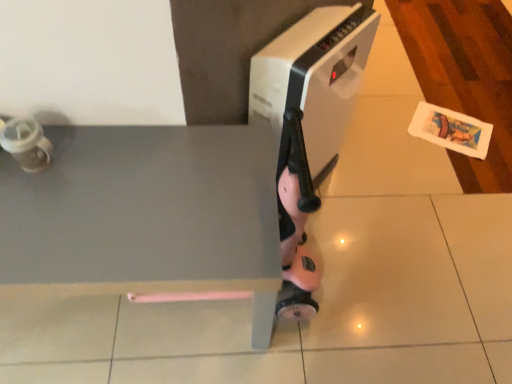
Where is `free point to the right of matte gray table at lower left`? free point to the right of matte gray table at lower left is located at coordinates (352, 291).